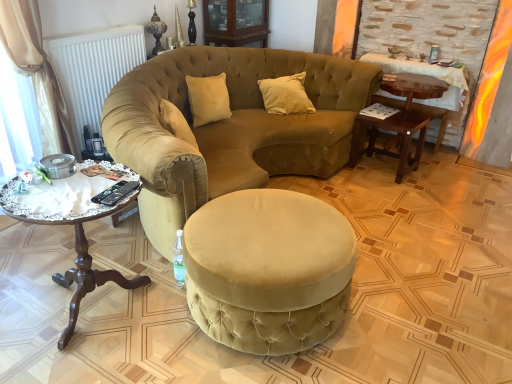
Question: Considering the positions of black plastic remote control at lower left and velvet ottoman at center in the image, is black plastic remote control at lower left taller or shorter than velvet ottoman at center?

Choices:
 (A) tall
 (B) short

Answer: (B)

Question: Is black plastic remote control at lower left in front of or behind velvet ottoman at center in the image?

Choices:
 (A) behind
 (B) front

Answer: (A)

Question: Which object is positioned farthest from the satin beige pillow at center?

Choices:
 (A) woodenwoodencoffee table at left
 (B) white matte radiator at upper left
 (C) matte wood cabinet at upper center
 (D) wooden side table at right
 (E) wooden table at right

Answer: (A)

Question: Which object is the closest to the velvet beige sofa at center?

Choices:
 (A) wooden table at right
 (B) beige satin curtain at left
 (C) wooden side table at right
 (D) woodenwoodencoffee table at left
 (E) satin beige pillow at center

Answer: (E)